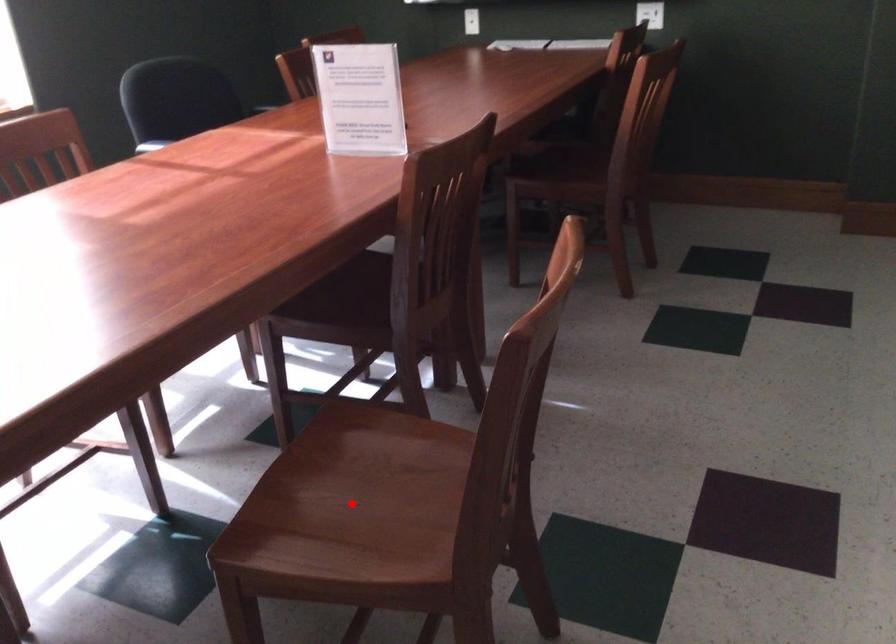
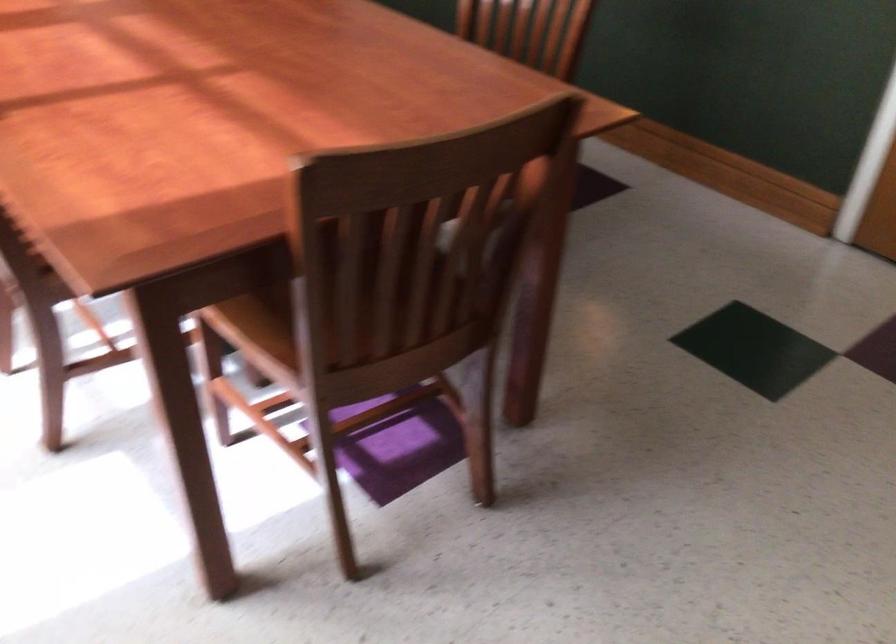
Question: I am providing you with two images of the same scene from different viewpoints. A red point is marked on the first image. At the location where the point appears in image 1, is it still visible in image 2?

Choices:
 (A) Yes
 (B) No

Answer: (B)